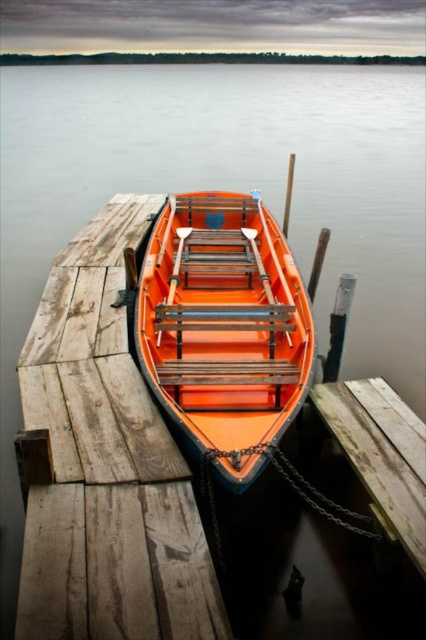
Question: Which point is closer to the camera?

Choices:
 (A) (400, 438)
 (B) (109, 349)

Answer: (A)

Question: Does wooden dock at center come in front of weathered wood bench at lower center?

Choices:
 (A) yes
 (B) no

Answer: (B)

Question: In this image, where is wooden dock at center located relative to weathered wood bench at lower center?

Choices:
 (A) below
 (B) above

Answer: (B)

Question: Does wooden dock at center lie behind orange matte wood boat at center?

Choices:
 (A) yes
 (B) no

Answer: (B)

Question: Which point is closer to the camera?

Choices:
 (A) (140, 435)
 (B) (393, 444)

Answer: (A)

Question: Among these objects, which one is farthest from the camera?

Choices:
 (A) orange matte wood boat at center
 (B) weathered wood bench at lower center
 (C) wooden dock at center

Answer: (A)